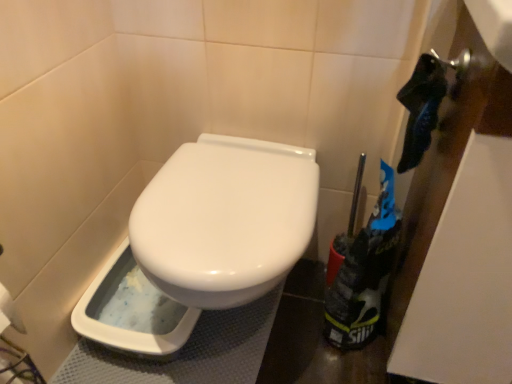
Question: Should I look upward or downward to see black fabric bag at right?

Choices:
 (A) down
 (B) up

Answer: (A)

Question: Does white plastic bidet at lower left have a greater width compared to black fabric bag at right?

Choices:
 (A) no
 (B) yes

Answer: (B)

Question: Can you confirm if white plastic bidet at lower left is positioned to the left of black fabric bag at right?

Choices:
 (A) yes
 (B) no

Answer: (A)

Question: From the image's perspective, is white plastic bidet at lower left located beneath black fabric bag at right?

Choices:
 (A) yes
 (B) no

Answer: (A)

Question: Is white plastic bidet at lower left bigger than black fabric bag at right?

Choices:
 (A) no
 (B) yes

Answer: (A)

Question: From a real-world perspective, is white plastic bidet at lower left on black fabric bag at right?

Choices:
 (A) no
 (B) yes

Answer: (A)

Question: Is white plastic bidet at lower left smaller than black fabric bag at right?

Choices:
 (A) no
 (B) yes

Answer: (B)

Question: Is the depth of black fabric bag at right less than that of white plastic bidet at lower left?

Choices:
 (A) yes
 (B) no

Answer: (A)

Question: Considering the relative sizes of black fabric bag at right and white plastic bidet at lower left in the image provided, is black fabric bag at right smaller than white plastic bidet at lower left?

Choices:
 (A) yes
 (B) no

Answer: (B)

Question: Is black fabric bag at right bigger than white plastic bidet at lower left?

Choices:
 (A) yes
 (B) no

Answer: (A)

Question: Is black fabric bag at right at the left side of white plastic bidet at lower left?

Choices:
 (A) yes
 (B) no

Answer: (B)

Question: Can you confirm if black fabric bag at right is shorter than white plastic bidet at lower left?

Choices:
 (A) yes
 (B) no

Answer: (B)

Question: From the image's perspective, is black fabric bag at right below white plastic bidet at lower left?

Choices:
 (A) no
 (B) yes

Answer: (A)

Question: Considering the positions of black fabric bag at right and white plastic bidet at lower left in the image, is black fabric bag at right bigger or smaller than white plastic bidet at lower left?

Choices:
 (A) big
 (B) small

Answer: (A)